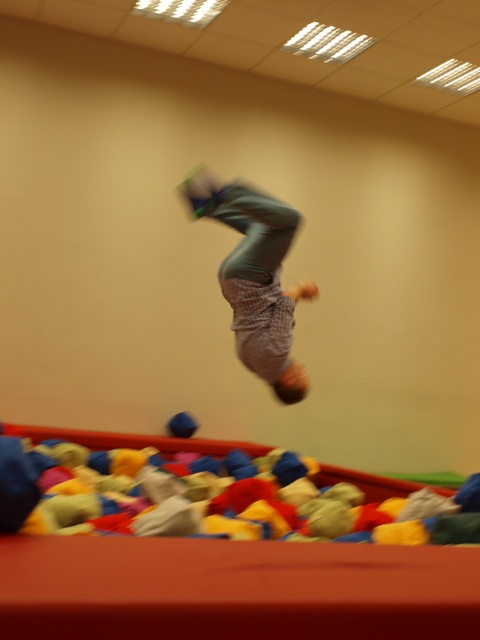
Which is above, soft fabric ball at center or plaid fabric pants at center?

plaid fabric pants at center is higher up.

Can you confirm if soft fabric ball at center is positioned to the left of plaid fabric pants at center?

Correct, you'll find soft fabric ball at center to the left of plaid fabric pants at center.

The height and width of the screenshot is (640, 480). What do you see at coordinates (207, 493) in the screenshot?
I see `soft fabric ball at center` at bounding box center [207, 493].

You are a GUI agent. You are given a task and a screenshot of the screen. Output one action in this format:
    pyautogui.click(x=<x>, y=<y>)
    Task: Click on the soft fabric ball at center
    
    Given the screenshot: What is the action you would take?
    pyautogui.click(x=207, y=493)